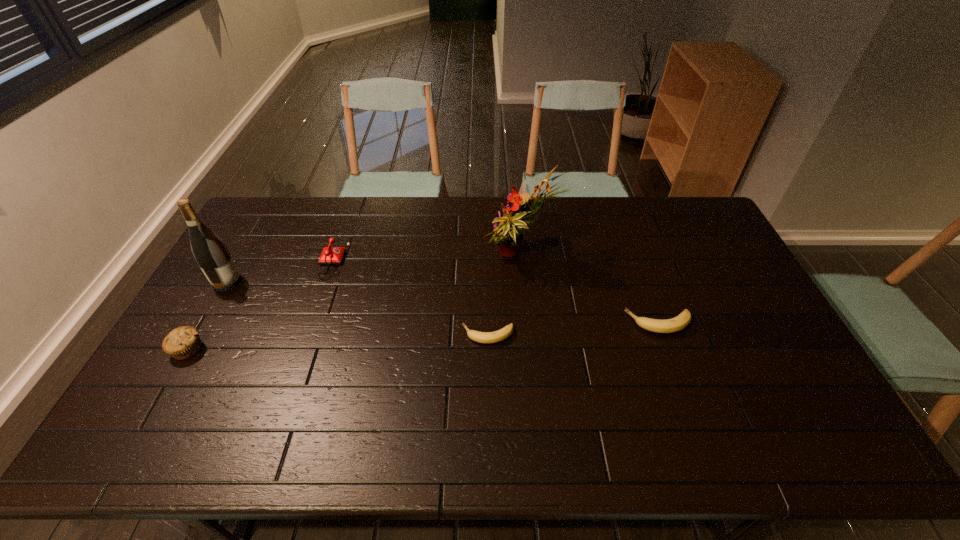
Where is `vacant point located at the stem of the shorter banana`? The image size is (960, 540). vacant point located at the stem of the shorter banana is located at coordinates (444, 335).

At what (x,y) coordinates should I click in order to perform the action: click on vacant space located at the stem of the shorter banana. Please return your answer as a coordinate pair (x, y). This screenshot has width=960, height=540. Looking at the image, I should click on (420, 335).

The height and width of the screenshot is (540, 960). I want to click on free point located at the stem of the second shortest object, so click(580, 323).

At what (x,y) coordinates should I click in order to perform the action: click on free space located 0.160m at the stem of the second shortest object. Please return your answer as a coordinate pair (x, y). The width and height of the screenshot is (960, 540). Looking at the image, I should click on (573, 323).

Identify the location of vacant region located at the stem of the second shortest object. (535, 323).

Identify the location of vacant space located 0.380m on the dial of the fourth tallest object. This screenshot has width=960, height=540. (459, 258).

Where is `free space located on the label of the wine bottle`? free space located on the label of the wine bottle is located at coordinates (298, 282).

Where is `blank space located on the front-facing side of the bouquet`? blank space located on the front-facing side of the bouquet is located at coordinates (434, 258).

Locate an element on the screen. Image resolution: width=960 pixels, height=540 pixels. free space located 0.220m on the front-facing side of the bouquet is located at coordinates (416, 258).

Locate an element on the screen. blank space located 0.090m on the front-facing side of the bouquet is located at coordinates (454, 258).